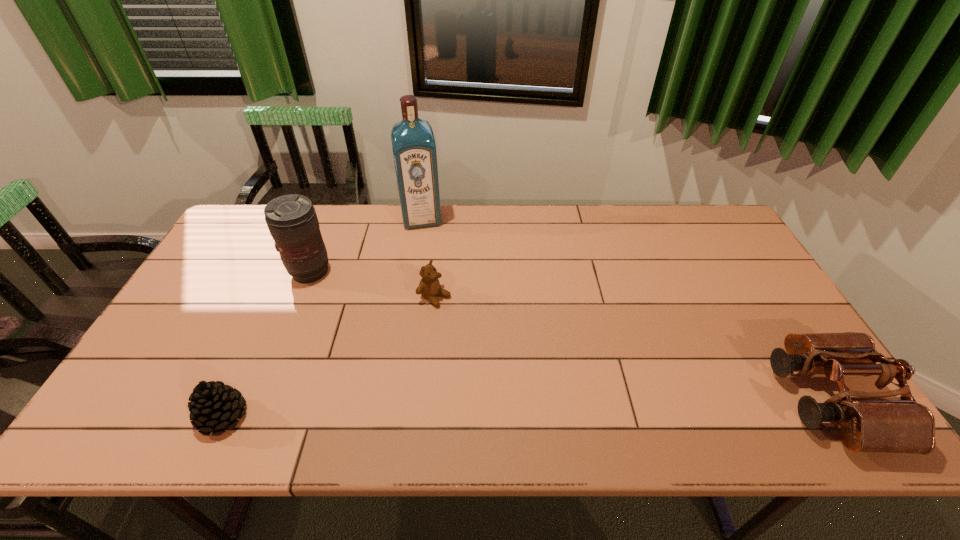
Where is `vacant region between the rightmost object and the teddy bear`? Image resolution: width=960 pixels, height=540 pixels. vacant region between the rightmost object and the teddy bear is located at coordinates (632, 348).

Image resolution: width=960 pixels, height=540 pixels. What are the coordinates of `vacant area that lies between the rightmost object and the pinecone` in the screenshot? It's located at (526, 408).

Identify the location of free space between the third shortest object and the telephoto lens. (569, 336).

Identify the location of vacant region between the farthest object and the fourth shortest object. [x=366, y=245].

Where is `empty location between the teddy bear and the liquor`? empty location between the teddy bear and the liquor is located at coordinates (428, 257).

I want to click on free space between the telephoto lens and the pinecone, so click(x=267, y=344).

Locate an element on the screen. free space that is in between the rightmost object and the liquor is located at coordinates (625, 309).

Find the location of a particular element. The width and height of the screenshot is (960, 540). free spot between the third tallest object and the telephoto lens is located at coordinates (569, 336).

The image size is (960, 540). In order to click on vacant point located between the pinecone and the tallest object in this screenshot , I will do `click(323, 317)`.

Identify which object is the third closest to the third shortest object. Please provide its 2D coordinates. Your answer should be formatted as a tuple, i.e. [(x, y)], where the tuple contains the x and y coordinates of a point satisfying the conditions above.

[(292, 221)]